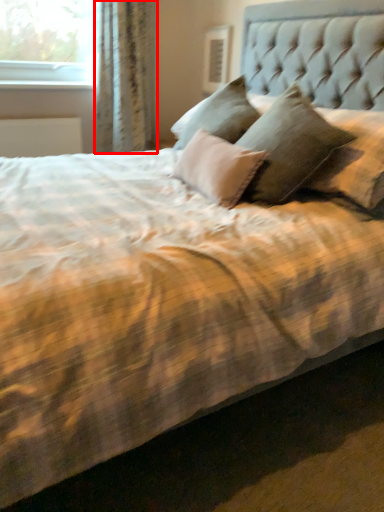
Question: In this image, where is curtain (annotated by the red box) located relative to window sill?

Choices:
 (A) right
 (B) left

Answer: (A)